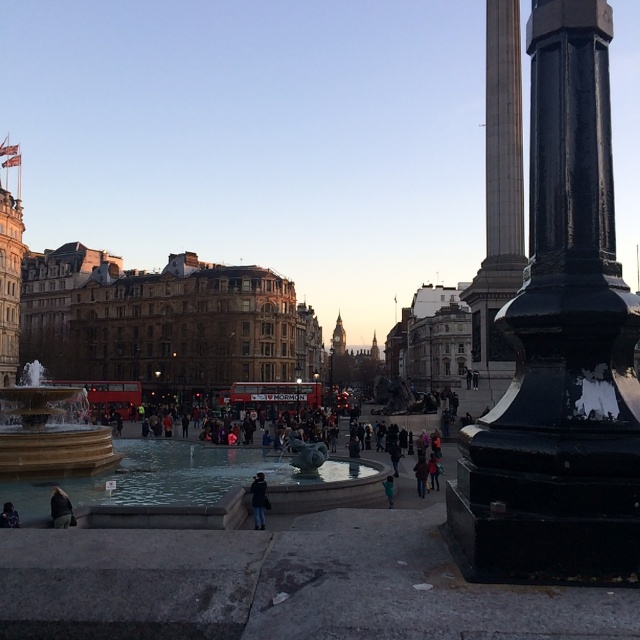
Question: Among these objects, which one is farthest from the camera?

Choices:
 (A) dark blue jeans at lower center
 (B) marble fountain at center

Answer: (A)

Question: Considering the relative positions of marble fountain at center and dark blue jeans at lower center in the image provided, where is marble fountain at center located with respect to dark blue jeans at lower center?

Choices:
 (A) above
 (B) below

Answer: (A)

Question: Is black polished column at center in front of dark blue jacket at lower left?

Choices:
 (A) yes
 (B) no

Answer: (A)

Question: Which object is positioned closest to the marble fountain at center?

Choices:
 (A) black polished column at center
 (B) dark blue jeans at center
 (C) dark blue jeans at lower center
 (D) green fabric jacket at lower center

Answer: (B)

Question: Among these objects, which one is nearest to the camera?

Choices:
 (A) black polished column at center
 (B) dark blue jeans at center
 (C) dark blue jacket at lower left
 (D) dark gray fabric jacket at lower left

Answer: (A)

Question: Is dark blue jeans at center further to the viewer compared to green fabric jacket at lower center?

Choices:
 (A) yes
 (B) no

Answer: (B)